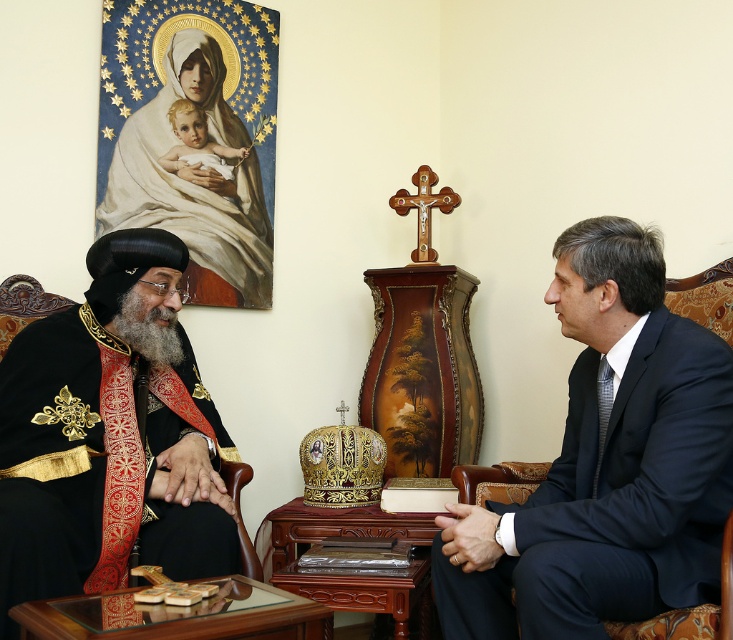
Can you confirm if dark blue suit at right is thinner than black velvet robe at left?

Yes.

Between dark blue suit at right and black velvet robe at left, which one is positioned higher?

black velvet robe at left

Is point (485, 630) positioned in front of point (213, 532)?

Yes.

You are a GUI agent. You are given a task and a screenshot of the screen. Output one action in this format:
    pyautogui.click(x=<x>, y=<y>)
    Task: Click on the dark blue suit at right
    
    Given the screenshot: What is the action you would take?
    coord(605,465)